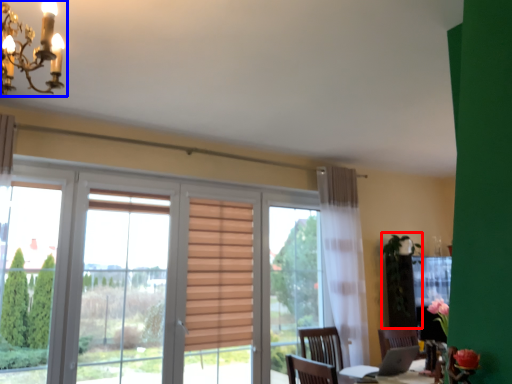
Question: Which of the following is the closest to the observer, plant (highlighted by a red box) or light fixture (highlighted by a blue box)?

Choices:
 (A) plant
 (B) light fixture

Answer: (B)